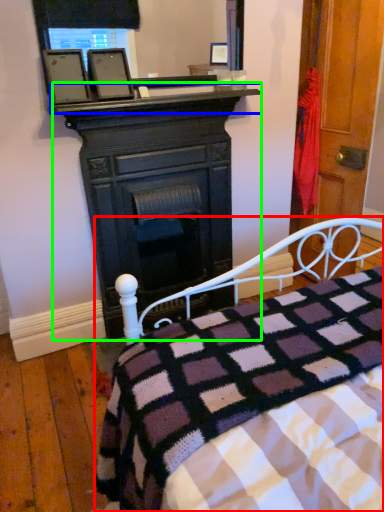
Question: Which object is the farthest from bed (highlighted by a red box)? Choose among these: mantle (highlighted by a blue box) or desk (highlighted by a green box).

Choices:
 (A) mantle
 (B) desk

Answer: (A)